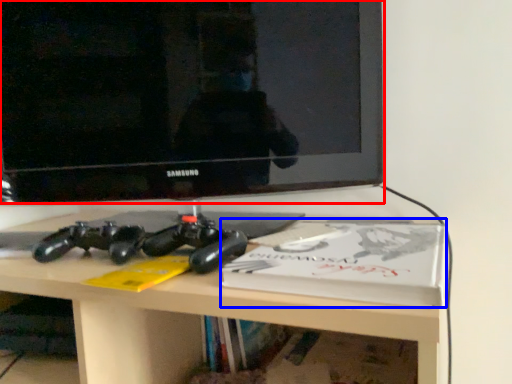
Question: Which object is closer to the camera taking this photo, television (highlighted by a red box) or paperback book (highlighted by a blue box)?

Choices:
 (A) television
 (B) paperback book

Answer: (B)